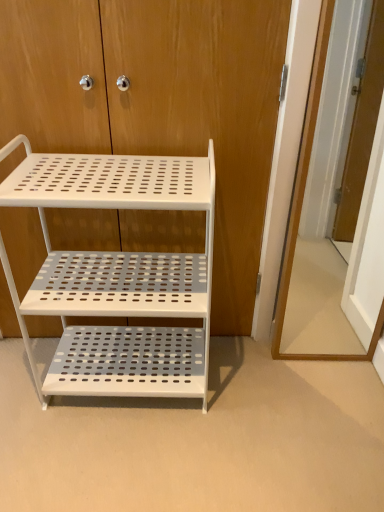
Identify the location of vacant area that lies between white perforated metal shelf at center and white perforated metal shelf at center. The image size is (384, 512). (209, 371).